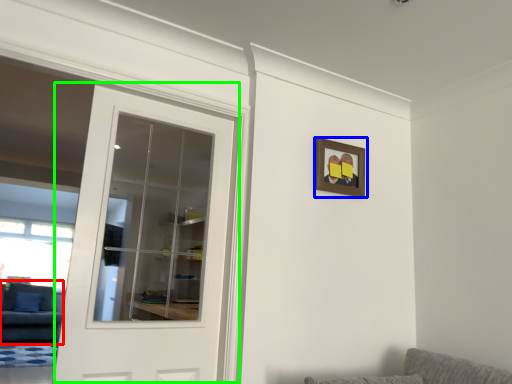
Question: Which object is the farthest from couch (highlighted by a red box)? Choose among these: picture frame (highlighted by a blue box) or door (highlighted by a green box).

Choices:
 (A) picture frame
 (B) door

Answer: (A)